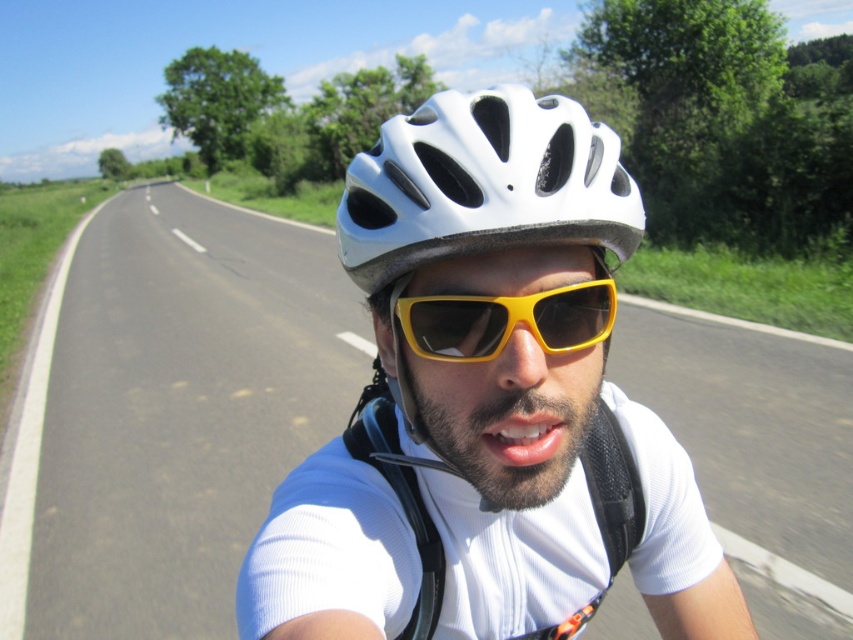
You are a cyclist who wants to ensure their gear is properly positioned. Looking at the image, is the white matte helmet at center placed above or below the white matte bicycle helmet at center?

The white matte helmet at center is below the white matte bicycle helmet at center.

You are a cyclist riding along the road and you want to check if your white matte bicycle helmet at center is exactly at the point marked with coordinates (483, 182). Can you confirm this?

The white matte bicycle helmet at center is located at point (483, 182), so yes, it is exactly at that coordinate.

You are a cyclist checking your gear before a ride. You have two white matte helmets in view. Which one is closer to you, the white matte helmet at center or the white matte bicycle helmet at center?

The white matte helmet at center is closer to the viewer than the white matte bicycle helmet at center.